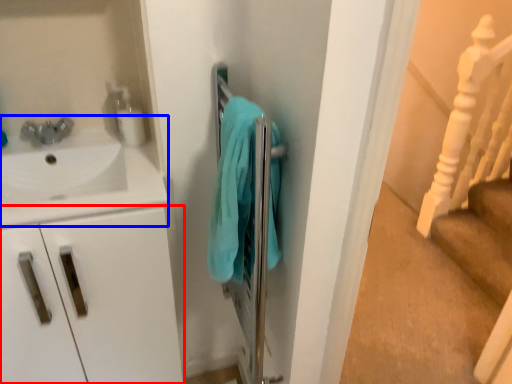
Question: Which point is closer to the camera, drawer (highlighted by a red box) or sink (highlighted by a blue box)?

Choices:
 (A) drawer
 (B) sink

Answer: (B)